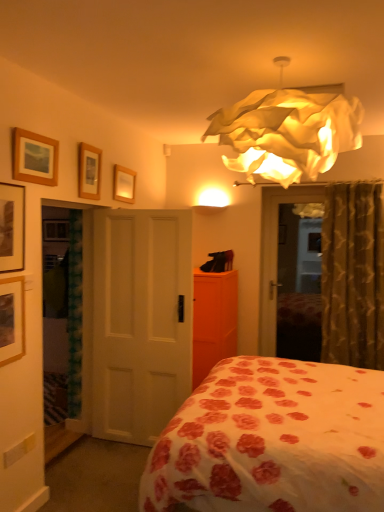
Question: Which direction should I rotate to face wooden picture frame at upper center, the 5th picture frame when ordered from left to right, — up or down?

Choices:
 (A) down
 (B) up

Answer: (B)

Question: Can you confirm if orange matte dresser at center is bigger than wooden picture frame at upper center, the first picture frame positioned from the right?

Choices:
 (A) yes
 (B) no

Answer: (A)

Question: From a real-world perspective, is orange matte dresser at center on top of wooden picture frame at upper center, the 5th picture frame when ordered from left to right?

Choices:
 (A) no
 (B) yes

Answer: (A)

Question: Considering the relative sizes of orange matte dresser at center and wooden picture frame at upper center, placed as the fifth picture frame when sorted from front to back, in the image provided, is orange matte dresser at center taller than wooden picture frame at upper center, placed as the fifth picture frame when sorted from front to back,?

Choices:
 (A) yes
 (B) no

Answer: (A)

Question: Is orange matte dresser at center shorter than wooden picture frame at upper center, the first picture frame positioned from the right?

Choices:
 (A) no
 (B) yes

Answer: (A)

Question: Is wooden picture frame at upper center, the first picture frame positioned from the right, at the back of orange matte dresser at center?

Choices:
 (A) no
 (B) yes

Answer: (A)

Question: Is wooden picture frame at upper center, the first picture frame positioned from the right, surrounded by orange matte dresser at center?

Choices:
 (A) yes
 (B) no

Answer: (B)

Question: Would you say wooden picture frame at upper center, which is counted as the first picture frame, starting from the back, is part of illuminated paper-like lampshade at upper center's contents?

Choices:
 (A) no
 (B) yes

Answer: (A)

Question: Does illuminated paper-like lampshade at upper center have a larger size compared to wooden picture frame at upper center, the first picture frame positioned from the right?

Choices:
 (A) no
 (B) yes

Answer: (B)

Question: Does illuminated paper-like lampshade at upper center have a greater width compared to wooden picture frame at upper center, which is counted as the first picture frame, starting from the back?

Choices:
 (A) yes
 (B) no

Answer: (A)

Question: Is illuminated paper-like lampshade at upper center smaller than wooden picture frame at upper center, placed as the fifth picture frame when sorted from front to back?

Choices:
 (A) yes
 (B) no

Answer: (B)

Question: Considering the relative positions of illuminated paper-like lampshade at upper center and wooden picture frame at upper center, placed as the fifth picture frame when sorted from front to back, in the image provided, is illuminated paper-like lampshade at upper center behind wooden picture frame at upper center, placed as the fifth picture frame when sorted from front to back,?

Choices:
 (A) yes
 (B) no

Answer: (B)

Question: Is illuminated paper-like lampshade at upper center positioned before wooden picture frame at upper center, the 5th picture frame when ordered from left to right?

Choices:
 (A) yes
 (B) no

Answer: (A)

Question: From a real-world perspective, is white floral fabric bed at center on top of wooden picture frame at left, placed as the 5th picture frame when sorted from back to front?

Choices:
 (A) yes
 (B) no

Answer: (B)